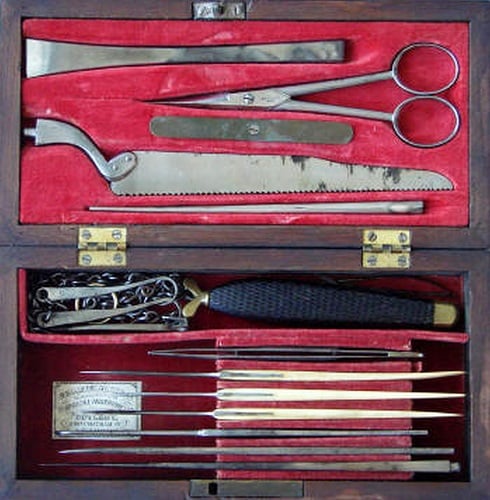
The width and height of the screenshot is (490, 500). I want to click on handle, so click(51, 130), click(314, 378), click(314, 394), click(312, 414).